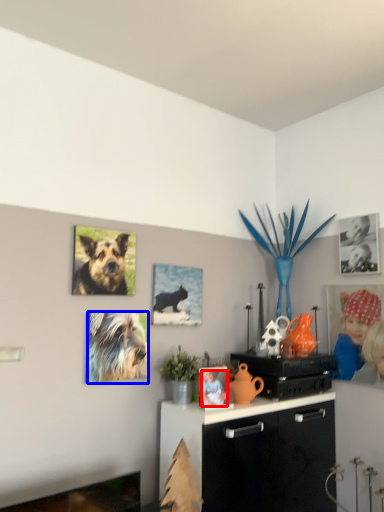
Question: Which object is closer to the camera taking this photo, person (highlighted by a red box) or dog (highlighted by a blue box)?

Choices:
 (A) person
 (B) dog

Answer: (B)